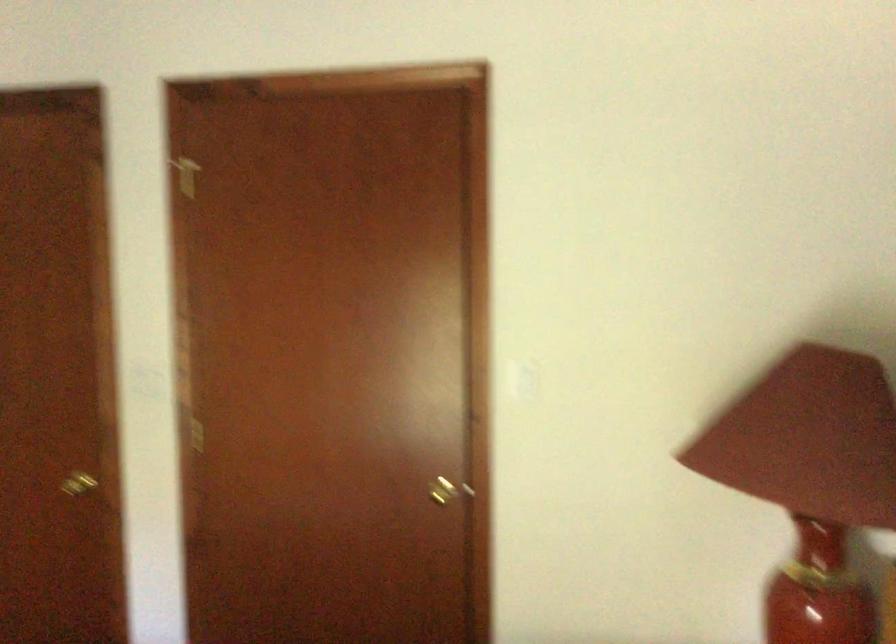
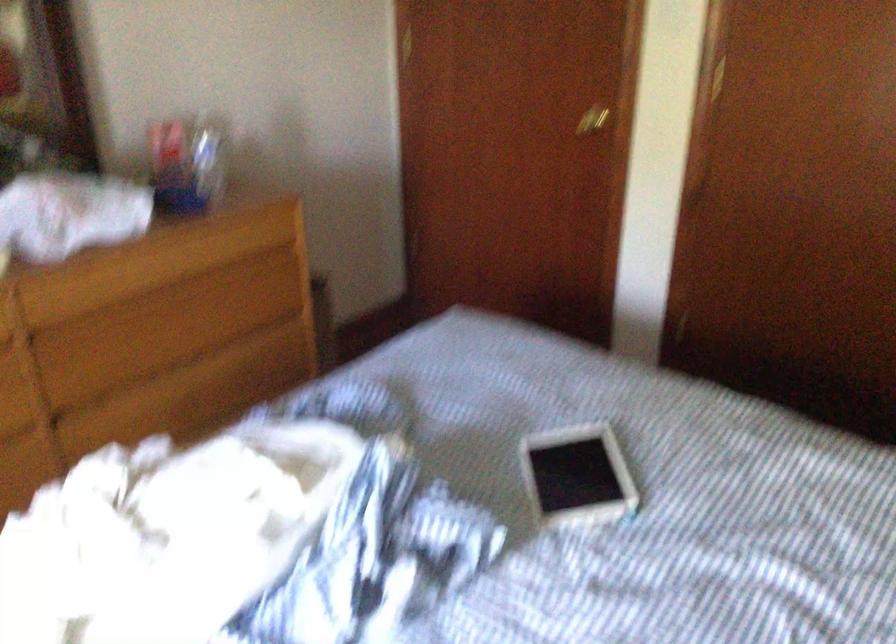
The point at (83, 483) is marked in the first image. Where is the corresponding point in the second image?

(592, 120)